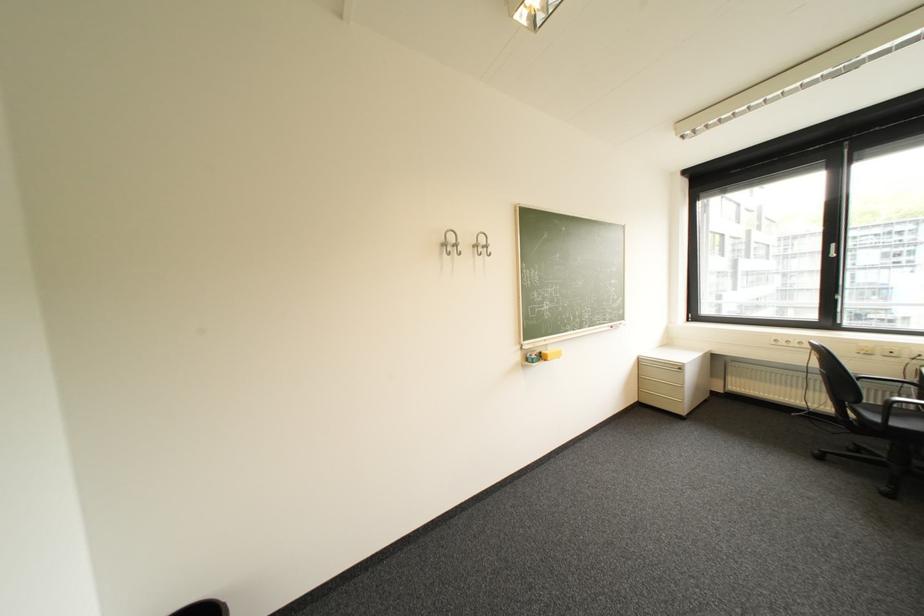
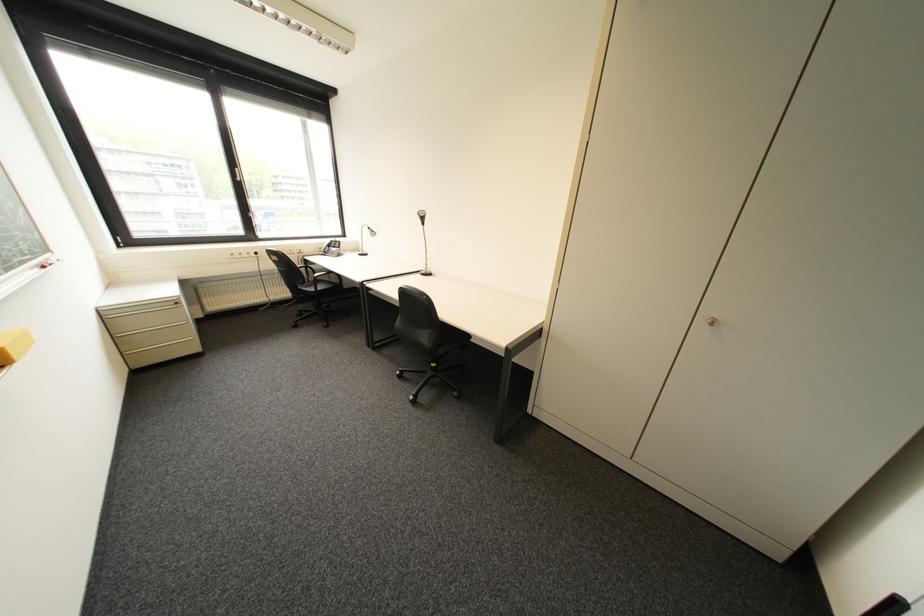
Locate, in the second image, the point that corresponds to the point at 649,376 in the first image.

(122, 336)